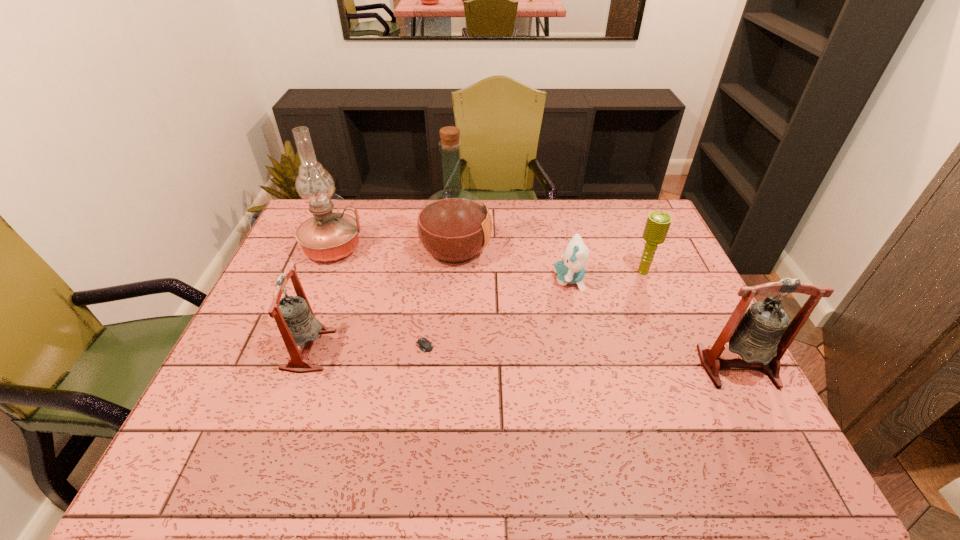
Where is `the shorter bell`? The image size is (960, 540). the shorter bell is located at coordinates (297, 324).

This screenshot has height=540, width=960. I want to click on the left bell, so click(x=297, y=324).

Find the location of a particular element. The image size is (960, 540). the right bell is located at coordinates [761, 335].

Where is `the fifth shortest object`? the fifth shortest object is located at coordinates (761, 335).

You are a GUI agent. You are given a task and a screenshot of the screen. Output one action in this format:
    pyautogui.click(x=<x>, y=<y>)
    Task: Click on the oil lamp
    Image resolution: width=960 pixels, height=540 pixels.
    Given the screenshot: What is the action you would take?
    pyautogui.click(x=328, y=236)

This screenshot has height=540, width=960. What are the coordinates of `the sixth tallest object` in the screenshot? It's located at pyautogui.click(x=571, y=270).

I want to click on kitten, so click(x=571, y=270).

Where is `liquor`? liquor is located at coordinates (453, 225).

Where is `mouse`? The width and height of the screenshot is (960, 540). mouse is located at coordinates (425, 345).

Image resolution: width=960 pixels, height=540 pixels. Find the location of `the fifth tallest object`. the fifth tallest object is located at coordinates (657, 225).